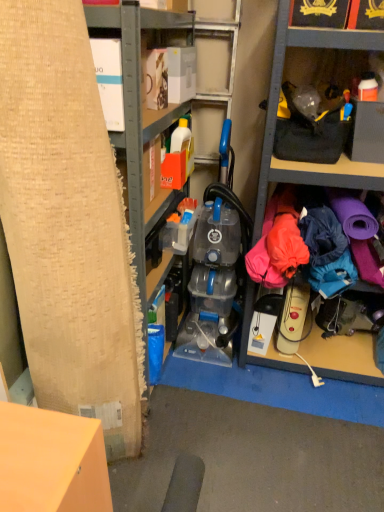
What do you see at coordinates (294, 236) in the screenshot?
I see `neon pink fabric at right` at bounding box center [294, 236].

I want to click on neon pink fabric at right, so click(294, 236).

This screenshot has height=512, width=384. I want to click on neon pink fabric at right, so click(x=294, y=236).